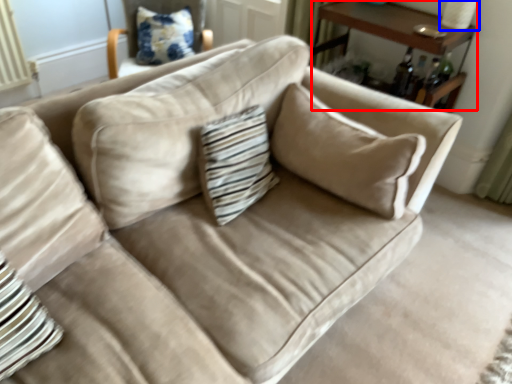
Question: Which point is further to the camera, table (highlighted by a red box) or table lamp (highlighted by a blue box)?

Choices:
 (A) table
 (B) table lamp

Answer: (B)